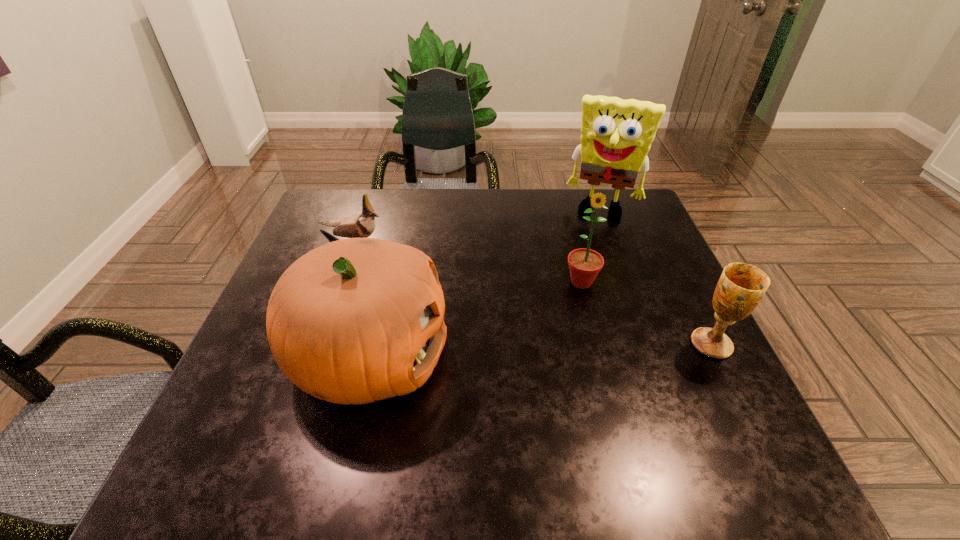
The image size is (960, 540). Find the location of `vacant region between the pumpkin and the chalice`. vacant region between the pumpkin and the chalice is located at coordinates (540, 350).

Locate an element on the screen. vacant space in between the chalice and the sponge is located at coordinates (657, 277).

Locate an element on the screen. The width and height of the screenshot is (960, 540). vacant space in between the chalice and the sunflower is located at coordinates (646, 313).

Where is `free space that is in between the pumpkin and the chalice`? free space that is in between the pumpkin and the chalice is located at coordinates (540, 350).

At what (x,y) coordinates should I click in order to perform the action: click on object that is the third closest to the fourth nearest object. Please return your answer as a coordinate pair (x, y). The width and height of the screenshot is (960, 540). Looking at the image, I should click on (616, 135).

Where is `object that stands as the third closest to the sunflower`? object that stands as the third closest to the sunflower is located at coordinates (353, 321).

I want to click on vacant area in the image that satisfies the following two spatial constraints: 1. on the front side of the bird; 2. on the left side of the third nearest object, so click(337, 282).

Locate an element on the screen. Image resolution: width=960 pixels, height=540 pixels. vacant space that satisfies the following two spatial constraints: 1. on the front side of the chalice; 2. on the left side of the farthest object is located at coordinates (653, 345).

Locate an element on the screen. This screenshot has height=540, width=960. free spot that satisfies the following two spatial constraints: 1. on the front side of the bird; 2. on the face of the pumpkin is located at coordinates (311, 356).